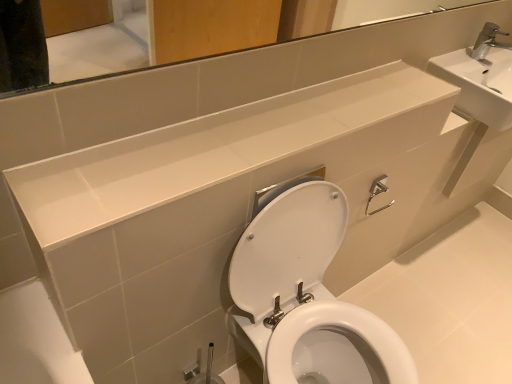
Question: In terms of height, does white glossy mirror at upper center look taller or shorter compared to white glossy toilet at center?

Choices:
 (A) tall
 (B) short

Answer: (A)

Question: From a real-world perspective, is white glossy mirror at upper center positioned above or below white glossy toilet at center?

Choices:
 (A) below
 (B) above

Answer: (B)

Question: Which object is the farthest from the white glossy toilet at center?

Choices:
 (A) white glossy counter top at upper center
 (B) white ceramic sink at upper right
 (C) white glossy mirror at upper center

Answer: (B)

Question: Which object is the closest to the white ceramic sink at upper right?

Choices:
 (A) white glossy mirror at upper center
 (B) white glossy counter top at upper center
 (C) white glossy toilet at center

Answer: (A)